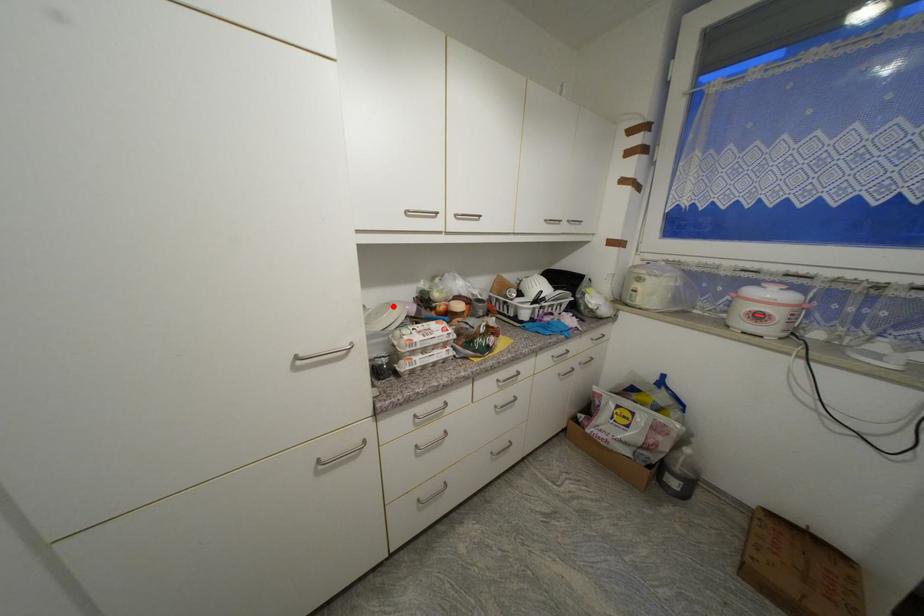
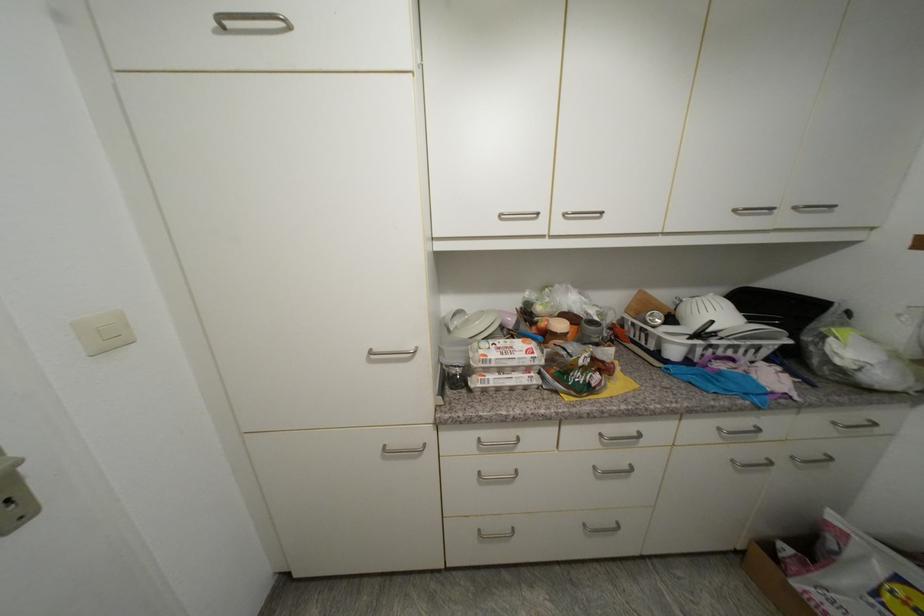
Where in the second image is the point corresponding to the highlighted location from the first image?

(489, 314)